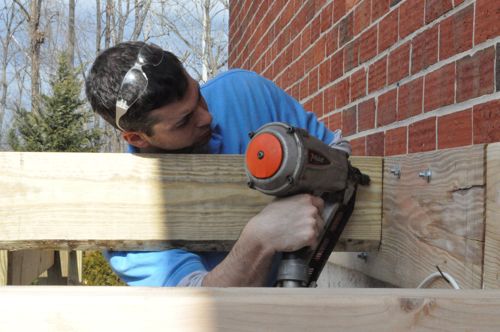
Find the location of a particular element. Image resolution: width=500 pixels, height=332 pixels. screws is located at coordinates (394, 171), (427, 173), (361, 254).